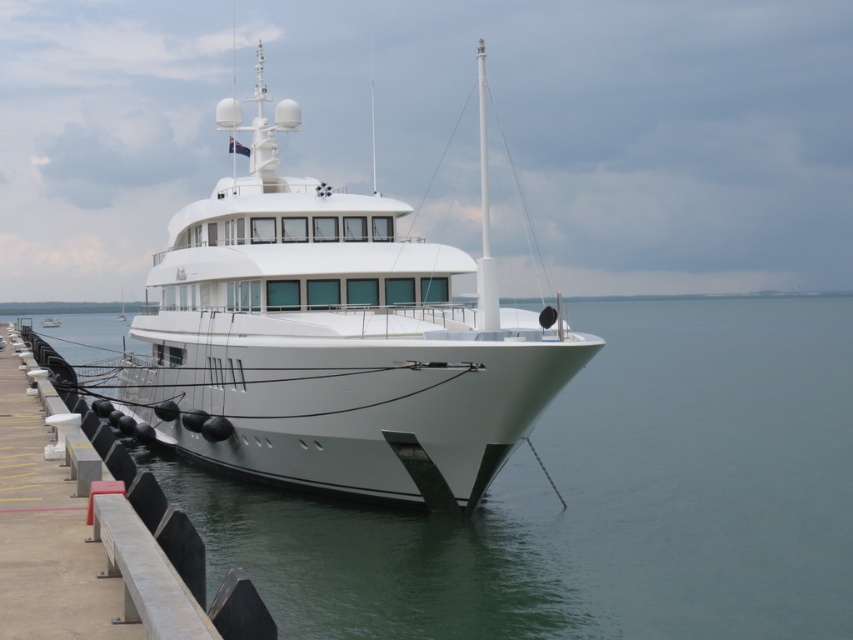
Question: Can you confirm if clear water at lower left is positioned to the left of white glossy yacht at center?

Choices:
 (A) no
 (B) yes

Answer: (A)

Question: Which point is farther from the camera taking this photo?

Choices:
 (A) click(x=235, y=260)
 (B) click(x=299, y=605)

Answer: (A)

Question: Where is clear water at lower left located in relation to white glossy yacht at center in the image?

Choices:
 (A) right
 (B) left

Answer: (A)

Question: Is clear water at lower left above white glossy yacht at center?

Choices:
 (A) no
 (B) yes

Answer: (A)

Question: Which object is closer to the camera taking this photo?

Choices:
 (A) clear water at lower left
 (B) white glossy yacht at center

Answer: (A)